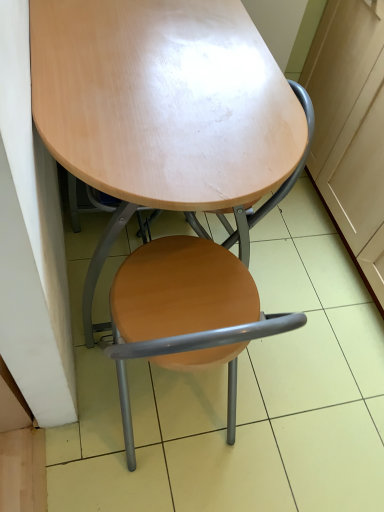
Question: Does matte wood cabinet at right appear on the right side of wooden seat at center?

Choices:
 (A) yes
 (B) no

Answer: (A)

Question: From a real-world perspective, is matte wood cabinet at right located higher than wooden seat at center?

Choices:
 (A) no
 (B) yes

Answer: (B)

Question: Would you say matte wood cabinet at right is a long distance from wooden seat at center?

Choices:
 (A) no
 (B) yes

Answer: (A)

Question: Does matte wood cabinet at right have a lesser height compared to wooden seat at center?

Choices:
 (A) no
 (B) yes

Answer: (A)

Question: Is matte wood cabinet at right at the left side of wooden seat at center?

Choices:
 (A) yes
 (B) no

Answer: (B)

Question: Relative to matte wood cabinet at right, is wooden seat at center in front or behind?

Choices:
 (A) behind
 (B) front

Answer: (B)

Question: Is wooden seat at center wider or thinner than matte wood cabinet at right?

Choices:
 (A) thin
 (B) wide

Answer: (A)

Question: From the image's perspective, is wooden seat at center positioned above or below matte wood cabinet at right?

Choices:
 (A) above
 (B) below

Answer: (B)

Question: In terms of height, does wooden seat at center look taller or shorter compared to matte wood cabinet at right?

Choices:
 (A) short
 (B) tall

Answer: (A)

Question: From a real-world perspective, is glossy wood table at center physically located above or below matte wood cabinet at right?

Choices:
 (A) below
 (B) above

Answer: (B)

Question: From the image's perspective, is glossy wood table at center located above or below matte wood cabinet at right?

Choices:
 (A) above
 (B) below

Answer: (B)

Question: In terms of height, does glossy wood table at center look taller or shorter compared to matte wood cabinet at right?

Choices:
 (A) tall
 (B) short

Answer: (A)

Question: Considering the positions of glossy wood table at center and matte wood cabinet at right in the image, is glossy wood table at center wider or thinner than matte wood cabinet at right?

Choices:
 (A) thin
 (B) wide

Answer: (A)

Question: Based on their positions, is wooden seat at center located to the left or right of glossy wood table at center?

Choices:
 (A) right
 (B) left

Answer: (A)

Question: From a real-world perspective, is wooden seat at center physically located above or below glossy wood table at center?

Choices:
 (A) below
 (B) above

Answer: (A)